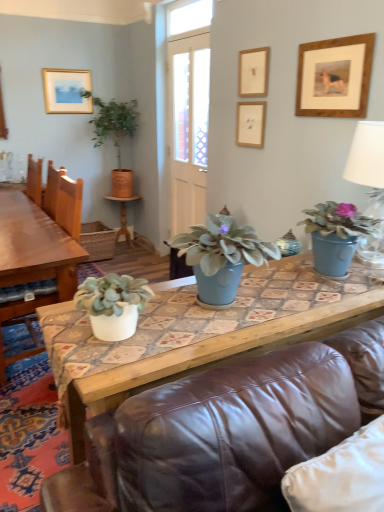
What are the coordinates of `wooden picture frame at upper right, the fourth picture frame positioned from the back` in the screenshot? It's located at (335, 77).

The width and height of the screenshot is (384, 512). I want to click on white matte plant pot at lower left, the 1th houseplant when ordered from front to back, so click(113, 304).

Describe the element at coordinates (253, 72) in the screenshot. I see `wooden picture frame at upper center, which ranks as the 3th picture frame in right-to-left order` at that location.

Image resolution: width=384 pixels, height=512 pixels. What do you see at coordinates (188, 17) in the screenshot? I see `clear glass window at upper center` at bounding box center [188, 17].

Find the location of `white glossy coffee table at left, positioned as the 1th coffee table in left-to-right order`. white glossy coffee table at left, positioned as the 1th coffee table in left-to-right order is located at coordinates (33, 259).

From a real-world perspective, is white matte plant pot at lower left, the 3th houseplant when ordered from right to left, below white glossy coffee table at left, which is the second coffee table in right-to-left order?

Incorrect, from a real-world perspective, white matte plant pot at lower left, the 3th houseplant when ordered from right to left, is higher than white glossy coffee table at left, which is the second coffee table in right-to-left order.

Which of these two, white matte plant pot at lower left, arranged as the 4th houseplant when viewed from the top, or white glossy coffee table at left, the second coffee table in the front-to-back sequence, is smaller?

With smaller size is white matte plant pot at lower left, arranged as the 4th houseplant when viewed from the top.

From the image's perspective, relative to white glossy coffee table at left, which is the second coffee table in right-to-left order, is white matte plant pot at lower left, arranged as the 4th houseplant when viewed from the top, above or below?

Clearly, from the image's perspective, white matte plant pot at lower left, arranged as the 4th houseplant when viewed from the top, is below white glossy coffee table at left, which is the second coffee table in right-to-left order.

Is white matte plant pot at lower left, acting as the fourth houseplant starting from the back, aimed at white glossy coffee table at left, positioned as the 1th coffee table in left-to-right order?

Yes.

Looking at this image, does matte brown wood side table at center have a larger size compared to white glossy coffee table at left, positioned as the 1th coffee table in left-to-right order?

No.

How many degrees apart are the facing directions of matte brown wood side table at center and white glossy coffee table at left, the second coffee table in the front-to-back sequence?

88.2 degrees.

From a real-world perspective, who is located higher, matte brown wood side table at center or white glossy coffee table at left, the second coffee table in the front-to-back sequence?

white glossy coffee table at left, the second coffee table in the front-to-back sequence, is physically above.

Measure the distance between matte brown wood side table at center and white glossy coffee table at left, which is the second coffee table in right-to-left order.

The distance of matte brown wood side table at center from white glossy coffee table at left, which is the second coffee table in right-to-left order, is 1.88 meters.

Locate an element on the screen. The height and width of the screenshot is (512, 384). houseplant that is the 1st object directly below the wooden picture frame at upper center, which is the 3th picture frame in back-to-front order (from a real-world perspective) is located at coordinates (115, 136).

In terms of height, does wooden picture frame at upper center, placed as the second picture frame when sorted from front to back, look taller or shorter compared to green leafy plant in terracotta pot at upper left, the 1th houseplant viewed from the left?

Considering their sizes, wooden picture frame at upper center, placed as the second picture frame when sorted from front to back, has less height than green leafy plant in terracotta pot at upper left, the 1th houseplant viewed from the left.

From the image's perspective, relative to green leafy plant in terracotta pot at upper left, the 4th houseplant from the front, is wooden picture frame at upper center, which ranks as the 3th picture frame in right-to-left order, above or below?

wooden picture frame at upper center, which ranks as the 3th picture frame in right-to-left order, is situated higher than green leafy plant in terracotta pot at upper left, the 4th houseplant from the front, in the image.

Which is more to the right, wooden picture frame at upper center, which is the 3th picture frame in back-to-front order, or green leafy plant in terracotta pot at upper left, the 4th houseplant from the front?

wooden picture frame at upper center, which is the 3th picture frame in back-to-front order, is more to the right.

Where is `coffee table lying above the white satin pillow at lower right (from the image's perspective)`? The width and height of the screenshot is (384, 512). coffee table lying above the white satin pillow at lower right (from the image's perspective) is located at coordinates (33, 259).

Which object is positioned more to the right, white glossy coffee table at left, arranged as the 1th coffee table when viewed from the back, or white satin pillow at lower right?

From the viewer's perspective, white satin pillow at lower right appears more on the right side.

Does white glossy coffee table at left, which is the second coffee table in right-to-left order, have a smaller size compared to white satin pillow at lower right?

Actually, white glossy coffee table at left, which is the second coffee table in right-to-left order, might be larger than white satin pillow at lower right.

Is white glossy coffee table at left, positioned as the 1th coffee table in left-to-right order, spatially inside white satin pillow at lower right, or outside of it?

The correct answer is: outside.

From a real-world perspective, which object rests below the other?

white glossy coffee table at left, arranged as the 1th coffee table when viewed from the back, from a real-world perspective.

In terms of size, does white glossy coffee table at left, positioned as the 1th coffee table in left-to-right order, appear bigger or smaller than green leafy plant in terracotta pot at upper left, the 1th houseplant viewed from the left?

white glossy coffee table at left, positioned as the 1th coffee table in left-to-right order, is bigger than green leafy plant in terracotta pot at upper left, the 1th houseplant viewed from the left.

From a real-world perspective, starting from the white glossy coffee table at left, arranged as the 1th coffee table when viewed from the back, which houseplant is the 4th one vertically above it? Please provide its 2D coordinates.

[(115, 136)]

Is white glossy coffee table at left, the second coffee table in the front-to-back sequence, next to green leafy plant in terracotta pot at upper left, the 1th houseplant in the back-to-front sequence?

No, white glossy coffee table at left, the second coffee table in the front-to-back sequence, is not next to green leafy plant in terracotta pot at upper left, the 1th houseplant in the back-to-front sequence.

Considering the sizes of objects matte blue pot at right, acting as the third houseplant starting from the front, and matte gold picture frame at upper left, positioned as the first picture frame in back-to-front order, in the image provided, who is shorter, matte blue pot at right, acting as the third houseplant starting from the front, or matte gold picture frame at upper left, positioned as the first picture frame in back-to-front order,?

matte blue pot at right, acting as the third houseplant starting from the front, is shorter.

Is point (372, 232) more distant than point (44, 69)?

No.

Based on their positions, is matte blue pot at right, which is the 4th houseplant from left to right, located to the left or right of matte gold picture frame at upper left, positioned as the first picture frame in back-to-front order?

Based on their positions, matte blue pot at right, which is the 4th houseplant from left to right, is located to the right of matte gold picture frame at upper left, positioned as the first picture frame in back-to-front order.

Which object is wider, matte blue pot at center, arranged as the 3th houseplant when viewed from the left, or white glossy coffee table at left, the second coffee table in the front-to-back sequence?

Wider between the two is white glossy coffee table at left, the second coffee table in the front-to-back sequence.

Is matte blue pot at center, marked as the second houseplant in a bottom-to-top arrangement, inside the boundaries of white glossy coffee table at left, arranged as the 1th coffee table when viewed from the back, or outside?

matte blue pot at center, marked as the second houseplant in a bottom-to-top arrangement, is spatially situated outside white glossy coffee table at left, arranged as the 1th coffee table when viewed from the back.

Is matte blue pot at center, marked as the second houseplant in a bottom-to-top arrangement, far from white glossy coffee table at left, positioned as the 1th coffee table in left-to-right order?

That's right, there is a large distance between matte blue pot at center, marked as the second houseplant in a bottom-to-top arrangement, and white glossy coffee table at left, positioned as the 1th coffee table in left-to-right order.

You are a GUI agent. You are given a task and a screenshot of the screen. Output one action in this format:
    pyautogui.click(x=<x>, y=<y>)
    Task: Click on the 3rd houseplant in front of the white glossy coffee table at left, arranged as the 1th coffee table when viewed from the back, counting from the anchor's position
    The height and width of the screenshot is (512, 384).
    Given the screenshot: What is the action you would take?
    pyautogui.click(x=113, y=304)

This screenshot has height=512, width=384. What are the coordinates of `coffee table on the left of matte brown wood side table at center` in the screenshot? It's located at (33, 259).

Which object lies nearer to the anchor point white ceramic lamp at upper right, matte blue pot at right, acting as the third houseplant starting from the front, or green leafy plant in terracotta pot at upper left, acting as the fourth houseplant starting from the right?

The object closer to white ceramic lamp at upper right is matte blue pot at right, acting as the third houseplant starting from the front.

Based on their spatial positions, is wooden picture frame at upper center, acting as the second picture frame starting from the back, or white ceramic lamp at upper right closer to matte blue vase at center, which is the 2th coffee table from left to right?

Among the two, white ceramic lamp at upper right is located nearer to matte blue vase at center, which is the 2th coffee table from left to right.

In the scene shown: When comparing their distances from green leafy plant in terracotta pot at upper left, the 1th houseplant in the back-to-front sequence, does matte blue pot at center, marked as the second houseplant in a bottom-to-top arrangement, or white satin pillow at lower right seem further?

white satin pillow at lower right lies further to green leafy plant in terracotta pot at upper left, the 1th houseplant in the back-to-front sequence, than the other object.

Based on their spatial positions, is white matte plant pot at lower left, which is counted as the second houseplant, starting from the left, or matte blue vase at center, which is the 2th coffee table from left to right, closer to white satin pillow at lower right?

matte blue vase at center, which is the 2th coffee table from left to right, lies closer to white satin pillow at lower right than the other object.

Looking at the image, which one is located closer to white matte plant pot at lower left, acting as the fourth houseplant starting from the back, white ceramic lamp at upper right or white glossy coffee table at left, the second coffee table in the front-to-back sequence?

Based on the image, white ceramic lamp at upper right appears to be nearer to white matte plant pot at lower left, acting as the fourth houseplant starting from the back.

Based on their spatial positions, is white glossy coffee table at left, which is the second coffee table in right-to-left order, or matte gold picture frame at upper left, positioned as the first picture frame in back-to-front order, closer to green leafy plant in terracotta pot at upper left, acting as the fourth houseplant starting from the right?

matte gold picture frame at upper left, positioned as the first picture frame in back-to-front order.

Based on their spatial positions, is white matte plant pot at lower left, which is counted as the second houseplant, starting from the left, or wooden picture frame at upper center, which is counted as the second picture frame, starting from the right, closer to wooden picture frame at upper center, which is the 3th picture frame in back-to-front order?

wooden picture frame at upper center, which is counted as the second picture frame, starting from the right.

Looking at the image, which one is located closer to wooden picture frame at upper center, acting as the second picture frame starting from the back, green leafy plant in terracotta pot at upper left, the 1th houseplant viewed from the left, or white matte plant pot at lower left, which appears as the first houseplant when ordered from the bottom?

white matte plant pot at lower left, which appears as the first houseplant when ordered from the bottom, lies closer to wooden picture frame at upper center, acting as the second picture frame starting from the back, than the other object.

At what (x,y) coordinates should I click in order to perform the action: click on window positioned between wooden picture frame at upper right, the fourth picture frame viewed from the left, and matte gold picture frame at upper left, arranged as the fourth picture frame when viewed from the front, from near to far. Please return your answer as a coordinate pair (x, y). This screenshot has height=512, width=384. Looking at the image, I should click on (188, 17).

This screenshot has width=384, height=512. Find the location of `window between matte blue pot at center, the 3th houseplant positioned from the top, and matte gold picture frame at upper left, arranged as the fourth picture frame when viewed from the front, in the front-back direction`. window between matte blue pot at center, the 3th houseplant positioned from the top, and matte gold picture frame at upper left, arranged as the fourth picture frame when viewed from the front, in the front-back direction is located at coordinates (188, 17).

The width and height of the screenshot is (384, 512). In order to click on lamp between white matte plant pot at lower left, arranged as the 4th houseplant when viewed from the top, and green leafy plant in terracotta pot at upper left, the 4th houseplant from the front, in the front-back direction in this screenshot , I will do `click(367, 156)`.

Where is `window between white satin pillow at lower right and green leafy plant in terracotta pot at upper left, placed as the 4th houseplant when sorted from bottom to top, from front to back`? Image resolution: width=384 pixels, height=512 pixels. window between white satin pillow at lower right and green leafy plant in terracotta pot at upper left, placed as the 4th houseplant when sorted from bottom to top, from front to back is located at coordinates (188, 17).